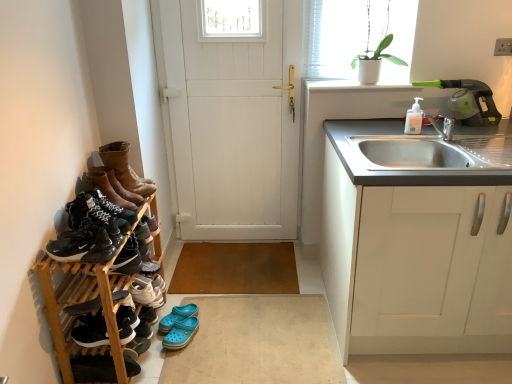
Find the location of a particular element. The height and width of the screenshot is (384, 512). vacant location below white wooden door at center (from a real-world perspective) is located at coordinates (243, 236).